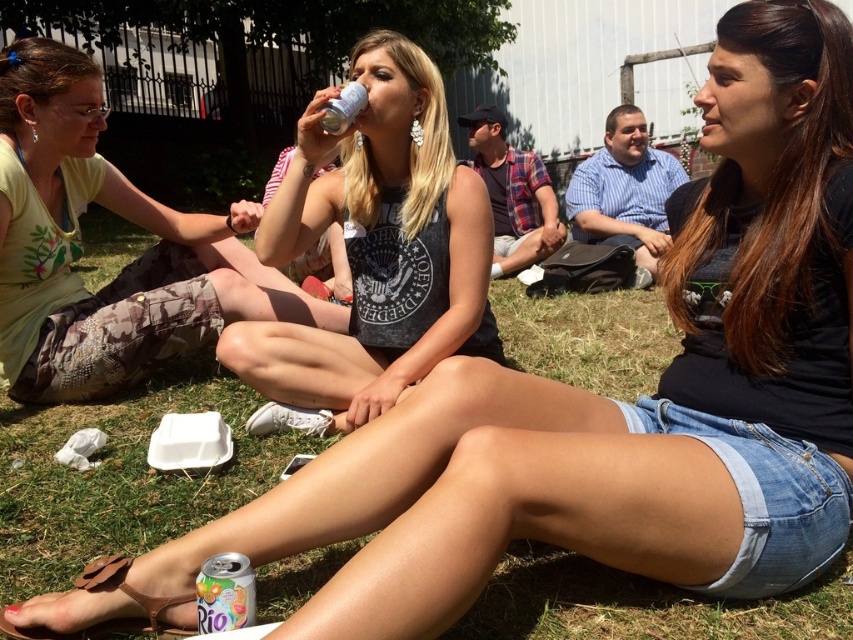
In the scene shown: Can you confirm if camouflage pants at left is positioned above brown leather sandal at lower left?

Correct, camouflage pants at left is located above brown leather sandal at lower left.

In the scene shown: Does camouflage pants at left have a greater height compared to brown leather sandal at lower left?

Yes, camouflage pants at left is taller than brown leather sandal at lower left.

Does point (70, 154) come closer to viewer compared to point (90, 572)?

No, (70, 154) is further to viewer.

This screenshot has width=853, height=640. Identify the location of camouflage pants at left. (122, 268).

Is matte black tank top at center further to the viewer compared to metallic silver can at lower left?

Yes, matte black tank top at center is further from the viewer.

Is matte black tank top at center wider than metallic silver can at lower left?

Correct, the width of matte black tank top at center exceeds that of metallic silver can at lower left.

Between point (425, 202) and point (204, 618), which one is positioned in front?

Point (204, 618) is more forward.

Identify the location of matte black tank top at center. (376, 248).

Can you confirm if matte black tank top at center is thinner than camouflage pants at left?

Indeed, matte black tank top at center has a lesser width compared to camouflage pants at left.

Can you confirm if matte black tank top at center is positioned to the right of camouflage pants at left?

Yes, matte black tank top at center is to the right of camouflage pants at left.

Is point (410, 333) closer to viewer compared to point (167, 264)?

Yes.

Where is `matte black tank top at center`? This screenshot has height=640, width=853. matte black tank top at center is located at coordinates (376, 248).